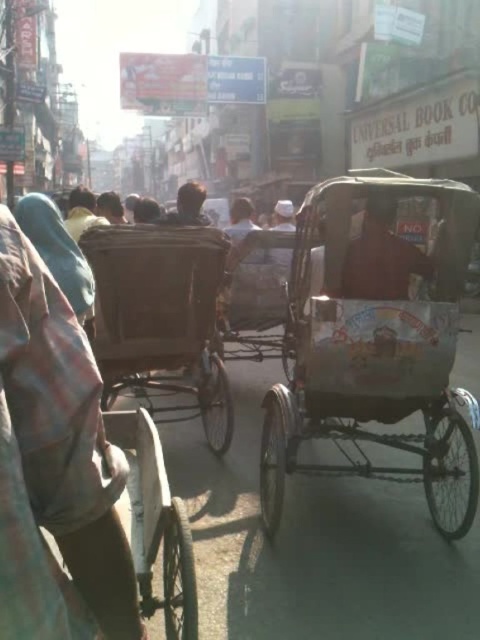
Which is behind, point (354, 410) or point (213, 266)?

Point (213, 266)

Is point (455, 298) less distant than point (169, 362)?

Yes, it is.

Locate an element on the screen. This screenshot has height=640, width=480. white painted wood rickshaw at center is located at coordinates (374, 333).